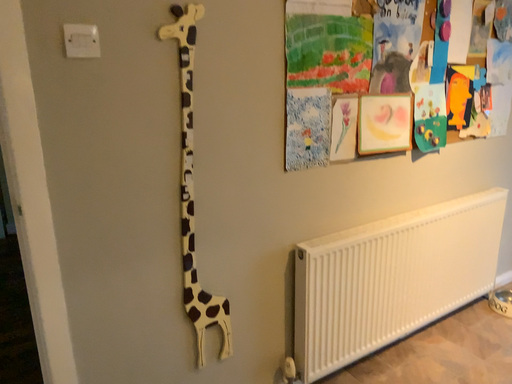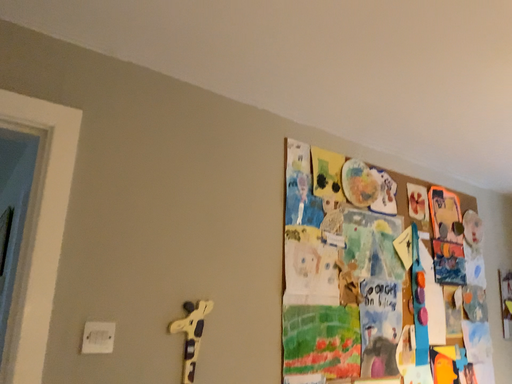
Question: How did the camera likely rotate when shooting the video?

Choices:
 (A) rotated downward
 (B) rotated upward

Answer: (B)